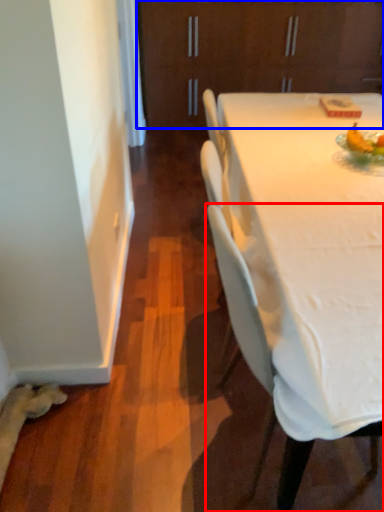
Question: Which of the following is the closest to the observer, chair (highlighted by a red box) or cabinetry (highlighted by a blue box)?

Choices:
 (A) chair
 (B) cabinetry

Answer: (A)